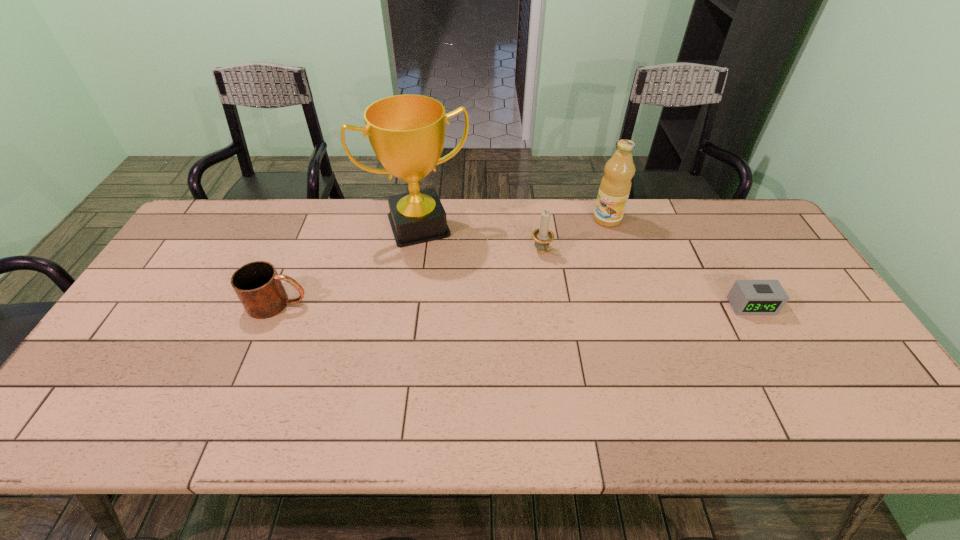
You are a GUI agent. You are given a task and a screenshot of the screen. Output one action in this format:
    pyautogui.click(x=<x>, y=<y>)
    Task: Click on the mug
    The width and height of the screenshot is (960, 540).
    Given the screenshot: What is the action you would take?
    pyautogui.click(x=257, y=284)

Where is `the leftmost object`? The width and height of the screenshot is (960, 540). the leftmost object is located at coordinates (257, 284).

Where is `alarm clock`? alarm clock is located at coordinates (747, 297).

Where is `the shortest object`? The image size is (960, 540). the shortest object is located at coordinates (747, 297).

This screenshot has height=540, width=960. Identify the location of the tallest object. (407, 132).

You are a GUI agent. You are given a task and a screenshot of the screen. Output one action in this format:
    pyautogui.click(x=<x>, y=<y>)
    Task: Click on the fourth object from right to left
    
    Given the screenshot: What is the action you would take?
    pyautogui.click(x=407, y=132)

In order to click on the third object from left to right in this screenshot , I will do `click(542, 236)`.

Locate an element on the screen. Image resolution: width=960 pixels, height=540 pixels. the third tallest object is located at coordinates (542, 236).

The image size is (960, 540). I want to click on olive oil, so click(615, 186).

You are a GUI agent. You are given a task and a screenshot of the screen. Output one action in this format:
    pyautogui.click(x=<x>, y=<y>)
    Task: Click on the second object from right to left
    The image size is (960, 540).
    Given the screenshot: What is the action you would take?
    pyautogui.click(x=615, y=186)